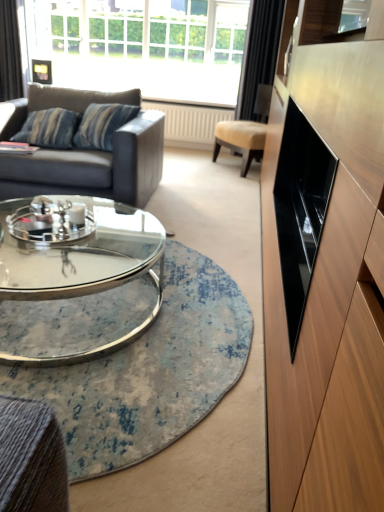
What do you see at coordinates (149, 373) in the screenshot? The image size is (384, 512). I see `glass/metal coffee table at center` at bounding box center [149, 373].

Measure the distance between beige leather chair at center and camera.

The depth of beige leather chair at center is 4.28 meters.

The image size is (384, 512). What do you see at coordinates (10, 52) in the screenshot?
I see `black velvet curtain at upper left, which is the first curtain in left-to-right order` at bounding box center [10, 52].

The image size is (384, 512). I want to click on dark gray leather couch at left, so tap(94, 166).

How far apart are black glossy drawer at right and white glass window at upper center?

They are 18.88 feet apart.

From the image's perspective, is black glossy drawer at right above or below white glass window at upper center?

black glossy drawer at right is situated lower than white glass window at upper center in the image.

Considering the relative positions of black glossy drawer at right and white glass window at upper center in the image provided, is black glossy drawer at right behind white glass window at upper center?

No, it is in front of white glass window at upper center.

Is black glossy drawer at right to the left of white glass window at upper center from the viewer's perspective?

Incorrect, black glossy drawer at right is not on the left side of white glass window at upper center.

Which is closer, (189, 9) or (250, 80)?

Clearly, point (189, 9) is more distant from the camera than point (250, 80).

Considering the relative positions of white glass window at upper center and black velvet curtain at upper right, which is the first curtain from right to left, in the image provided, is white glass window at upper center behind black velvet curtain at upper right, which is the first curtain from right to left,?

Yes, it is.

Can you tell me how much white glass window at upper center and black velvet curtain at upper right, which is the first curtain from right to left, differ in facing direction?

They differ by 0.219 degrees in their facing directions.

Based on the photo, which object is positioned more to the right, white glass window at upper center or black velvet curtain at upper right, the second curtain viewed from the left?

black velvet curtain at upper right, the second curtain viewed from the left, is more to the right.

Which is further, (x=130, y=70) or (x=102, y=359)?

Point (x=130, y=70)

Is white glass window at upper center surrounding glass/metal coffee table at center?

No, glass/metal coffee table at center is not surrounded by white glass window at upper center.

Does white glass window at upper center turn towards glass/metal coffee table at center?

Yes, white glass window at upper center is turned towards glass/metal coffee table at center.

Is white glass window at upper center next to glass/metal coffee table at center?

No, white glass window at upper center is not beside glass/metal coffee table at center.

The image size is (384, 512). What are the coordinates of `chair on the right of black velvet curtain at upper left, which is the first curtain in left-to-right order` in the screenshot? It's located at 246,132.

Does black velvet curtain at upper left, arranged as the 2th curtain when viewed from the right, have a lesser width compared to beige leather chair at center?

Yes.

Can you confirm if glass/metal coffee table at center is taller than clear glass coffee table at center?

In fact, glass/metal coffee table at center may be shorter than clear glass coffee table at center.

From a real-world perspective, between glass/metal coffee table at center and clear glass coffee table at center, who is vertically lower?

glass/metal coffee table at center is physically lower.

Would you say glass/metal coffee table at center is inside or outside clear glass coffee table at center?

glass/metal coffee table at center exists outside the volume of clear glass coffee table at center.

From the image's perspective, is glass/metal coffee table at center beneath clear glass coffee table at center?

Correct, glass/metal coffee table at center appears lower than clear glass coffee table at center in the image.

Which of these two, beige leather chair at center or white glass window at upper center, stands taller?

With more height is white glass window at upper center.

Can you confirm if beige leather chair at center is wider than white glass window at upper center?

Yes.

From the image's perspective, is beige leather chair at center under white glass window at upper center?

Yes.

You are a GUI agent. You are given a task and a screenshot of the screen. Output one action in this format:
    pyautogui.click(x=<x>, y=<y>)
    Task: Click on the window above the beige leather chair at center (from the image's perspective)
    
    Given the screenshot: What is the action you would take?
    pyautogui.click(x=142, y=46)

Which is less distant, [127,51] or [3,73]?

Clearly, point [127,51] is more distant from the camera than point [3,73].

From the image's perspective, which one is positioned lower, white glass window at upper center or black velvet curtain at upper left, arranged as the 2th curtain when viewed from the right?

black velvet curtain at upper left, arranged as the 2th curtain when viewed from the right, from the image's perspective.

There is a white glass window at upper center. At what (x,y) coordinates should I click in order to perform the action: click on the 1st curtain below it (from a real-world perspective). Please return your answer as a coordinate pair (x, y). Looking at the image, I should click on (10, 52).

Between white glass window at upper center and black velvet curtain at upper left, arranged as the 2th curtain when viewed from the right, which one has larger width?

white glass window at upper center.

Identify the location of drawer on the right side of white glass window at upper center. This screenshot has width=384, height=512. (300, 210).

At what (x,y) coordinates should I click in order to perform the action: click on window above the black velvet curtain at upper right, which is the first curtain from right to left (from the image's perspective). Please return your answer as a coordinate pair (x, y). Looking at the image, I should click on (142, 46).

From the image, which object appears to be farther from black velvet curtain at upper left, arranged as the 2th curtain when viewed from the right, glass/metal coffee table at center or white glass window at upper center?

Based on the image, glass/metal coffee table at center appears to be further to black velvet curtain at upper left, arranged as the 2th curtain when viewed from the right.

Based on their spatial positions, is white glass window at upper center or black velvet curtain at upper left, which is the first curtain in left-to-right order, further from clear glass coffee table at center?

white glass window at upper center.

Looking at the image, which one is located closer to black glossy drawer at right, glass/metal coffee table at center or beige leather chair at center?

glass/metal coffee table at center is closer to black glossy drawer at right.

When comparing their distances from white glass window at upper center, does black glossy drawer at right or dark gray leather couch at left seem closer?

dark gray leather couch at left lies closer to white glass window at upper center than the other object.

Considering their positions, is clear glass coffee table at center positioned closer to beige leather chair at center than black velvet curtain at upper right, which is the first curtain from right to left?

black velvet curtain at upper right, which is the first curtain from right to left.

Estimate the real-world distances between objects in this image. Which object is closer to glass/metal coffee table at center, beige leather chair at center or black glossy drawer at right?

Among the two, black glossy drawer at right is located nearer to glass/metal coffee table at center.

Looking at the image, which one is located closer to glass/metal coffee table at center, white glass window at upper center or clear glass coffee table at center?

clear glass coffee table at center.

Considering their positions, is beige leather chair at center positioned further to white glass window at upper center than black velvet curtain at upper left, arranged as the 2th curtain when viewed from the right?

Among the two, black velvet curtain at upper left, arranged as the 2th curtain when viewed from the right, is located further to white glass window at upper center.

Locate an element on the screen. Image resolution: width=384 pixels, height=512 pixels. window between dark gray leather couch at left and black velvet curtain at upper left, which is the first curtain in left-to-right order, along the z-axis is located at coordinates (142, 46).

Where is `coffee table located between glass/metal coffee table at center and white glass window at upper center in the depth direction`? coffee table located between glass/metal coffee table at center and white glass window at upper center in the depth direction is located at coordinates (77, 282).

Where is `coffee table located between glass/metal coffee table at center and black velvet curtain at upper right, the second curtain viewed from the left, in the depth direction`? The height and width of the screenshot is (512, 384). coffee table located between glass/metal coffee table at center and black velvet curtain at upper right, the second curtain viewed from the left, in the depth direction is located at coordinates (77, 282).

I want to click on studio couch between clear glass coffee table at center and black velvet curtain at upper right, which is the first curtain from right to left, from front to back, so click(94, 166).